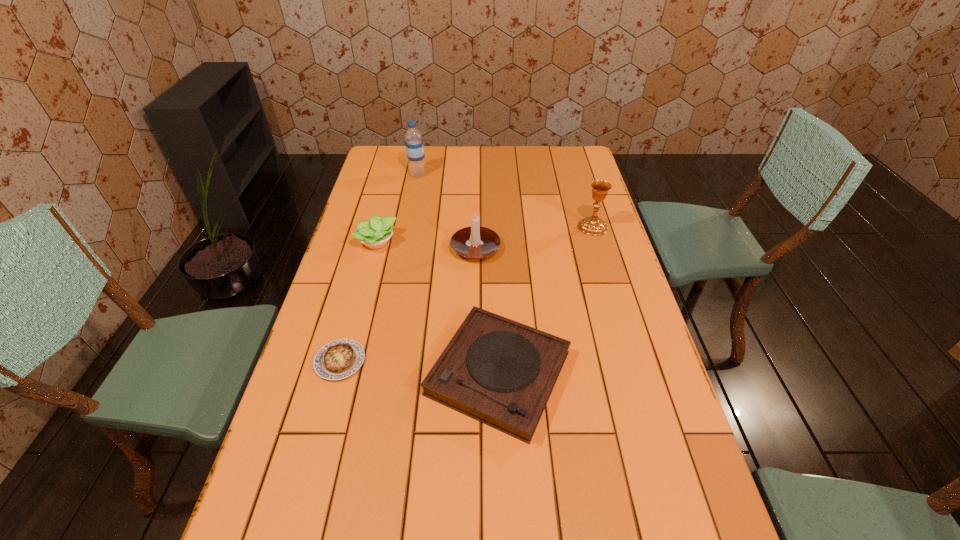
Where is `vacant space located 0.080m on the right of the fourth tallest object`? vacant space located 0.080m on the right of the fourth tallest object is located at coordinates (421, 242).

Where is `free space located 0.150m on the front of the phonograph record`? free space located 0.150m on the front of the phonograph record is located at coordinates (503, 517).

The width and height of the screenshot is (960, 540). Identify the location of free point located on the right of the quiche. (407, 361).

Where is `object present at the far edge`? object present at the far edge is located at coordinates (413, 138).

In order to click on lettuce that is at the left edge in this screenshot , I will do `click(374, 234)`.

Find the location of a particular element. Image resolution: width=960 pixels, height=540 pixels. quiche that is at the left edge is located at coordinates (338, 359).

You are a GUI agent. You are given a task and a screenshot of the screen. Output one action in this format:
    pyautogui.click(x=<x>, y=<y>)
    Task: Click on the object at the right edge
    This screenshot has width=960, height=540.
    Given the screenshot: What is the action you would take?
    pyautogui.click(x=593, y=225)

In the image, there is a desktop. Identify the location of free space at the far edge. This screenshot has height=540, width=960. (439, 169).

You are a GUI agent. You are given a task and a screenshot of the screen. Output one action in this format:
    pyautogui.click(x=<x>, y=<y>)
    Task: Click on the vacant space at the left edge of the desktop
    
    Given the screenshot: What is the action you would take?
    pyautogui.click(x=385, y=191)

Identify the location of vacant space at the right edge. The height and width of the screenshot is (540, 960). (590, 323).